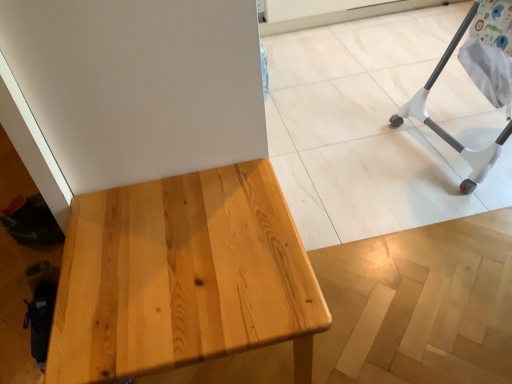
You are a GUI agent. You are given a task and a screenshot of the screen. Output one action in this format:
    pyautogui.click(x=<x>, y=<y>)
    Task: Click on the vacant region above natural wood table at center (from a real-world perspective)
    This screenshot has height=384, width=512.
    Given the screenshot: What is the action you would take?
    pos(176,248)